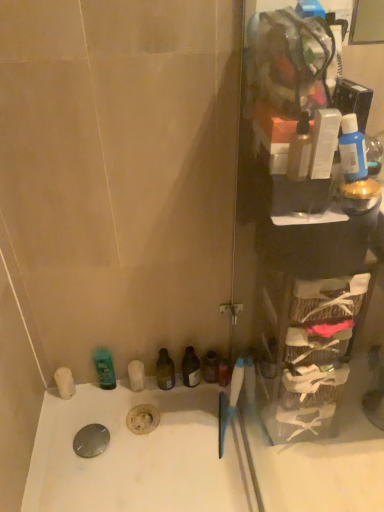
Question: Are white plastic bottle at upper right, which is counted as the second toiletry, starting from the bottom, and white matte soap at lower left, which is the second toiletry in front-to-back order, located far from each other?

Choices:
 (A) no
 (B) yes

Answer: (B)

Question: Is the position of white plastic bottle at upper right, which is the 2th toiletry from back to front, less distant than that of white matte soap at lower left, which is the 2th toiletry in top-to-bottom order?

Choices:
 (A) yes
 (B) no

Answer: (A)

Question: From the image's perspective, is white plastic bottle at upper right, the first toiletry positioned from the right, beneath white matte soap at lower left, positioned as the 1th toiletry in back-to-front order?

Choices:
 (A) yes
 (B) no

Answer: (B)

Question: Is white plastic bottle at upper right, which is counted as the second toiletry, starting from the bottom, beside white matte soap at lower left, which is the 2th toiletry in top-to-bottom order?

Choices:
 (A) yes
 (B) no

Answer: (B)

Question: From the image's perspective, is white plastic bottle at upper right, the first toiletry positioned from the right, on top of white matte soap at lower left, which ranks as the 2th toiletry in right-to-left order?

Choices:
 (A) yes
 (B) no

Answer: (A)

Question: From the image's perspective, is green matte mouthwash at lower left, arranged as the fifth mouthwash when viewed from the right, located above or below white plastic bottle at upper right, the 2th toiletry viewed from the left?

Choices:
 (A) above
 (B) below

Answer: (B)

Question: From their relative heights in the image, would you say green matte mouthwash at lower left, the 4th mouthwash when ordered from front to back, is taller or shorter than white plastic bottle at upper right, the 1th toiletry from the front?

Choices:
 (A) tall
 (B) short

Answer: (A)

Question: Does point (102, 373) appear closer or farther from the camera than point (321, 154)?

Choices:
 (A) farther
 (B) closer

Answer: (A)

Question: Considering the positions of green matte mouthwash at lower left, the 2th mouthwash from the back, and white plastic bottle at upper right, the 1th toiletry from the front, in the image, is green matte mouthwash at lower left, the 2th mouthwash from the back, wider or thinner than white plastic bottle at upper right, the 1th toiletry from the front,?

Choices:
 (A) wide
 (B) thin

Answer: (A)

Question: In terms of height, does blue glossy bottle at upper right, which is counted as the 2th mouthwash, starting from the front, look taller or shorter compared to translucent plastic bottle at upper right, acting as the 4th mouthwash starting from the bottom?

Choices:
 (A) tall
 (B) short

Answer: (A)

Question: Is blue glossy bottle at upper right, which is the fifth mouthwash from bottom to top, spatially inside translucent plastic bottle at upper right, acting as the 4th mouthwash starting from the bottom, or outside of it?

Choices:
 (A) inside
 (B) outside

Answer: (B)

Question: Based on their sizes in the image, would you say blue glossy bottle at upper right, acting as the 1th mouthwash starting from the right, is bigger or smaller than translucent plastic bottle at upper right, the first mouthwash viewed from the front?

Choices:
 (A) small
 (B) big

Answer: (B)

Question: From a real-world perspective, is blue glossy bottle at upper right, which is the fifth mouthwash from bottom to top, positioned above or below translucent plastic bottle at upper right, marked as the 5th mouthwash in a back-to-front arrangement?

Choices:
 (A) above
 (B) below

Answer: (A)

Question: Is point pos(94,354) closer or farther from the camera than point pos(296,166)?

Choices:
 (A) closer
 (B) farther

Answer: (B)

Question: From a real-world perspective, is green matte mouthwash at lower left, the 4th mouthwash when ordered from front to back, positioned above or below translucent plastic bottle at upper right, marked as the 5th mouthwash in a back-to-front arrangement?

Choices:
 (A) below
 (B) above

Answer: (A)